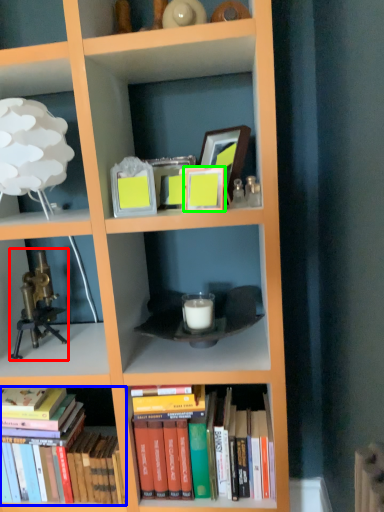
Question: Considering the real-world distances, which object is farthest from toy (highlighted by a red box)? book (highlighted by a blue box) or picture frame (highlighted by a green box)?

Choices:
 (A) book
 (B) picture frame

Answer: (B)